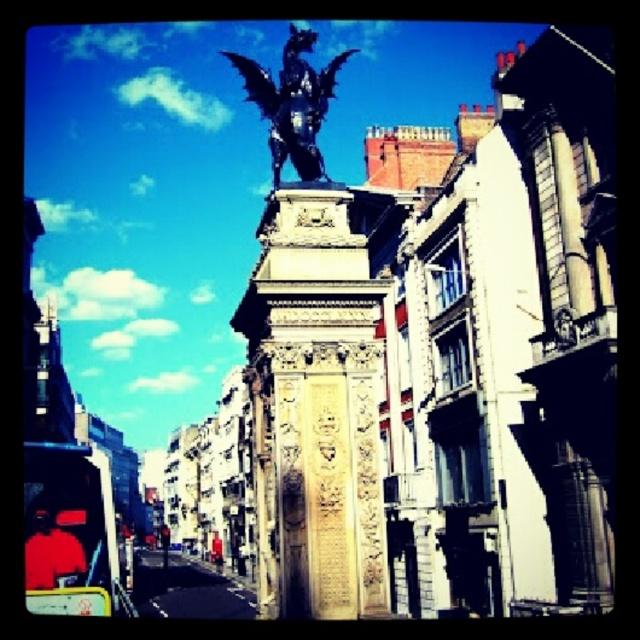
Question: From the image, what is the correct spatial relationship of black polished stone statue at center in relation to shiny black dragon at upper center?

Choices:
 (A) left
 (B) right

Answer: (A)

Question: Can you confirm if black polished stone statue at center is positioned to the left of shiny black dragon at upper center?

Choices:
 (A) yes
 (B) no

Answer: (A)

Question: Observing the image, what is the correct spatial positioning of black polished stone statue at center in reference to shiny black dragon at upper center?

Choices:
 (A) left
 (B) right

Answer: (A)